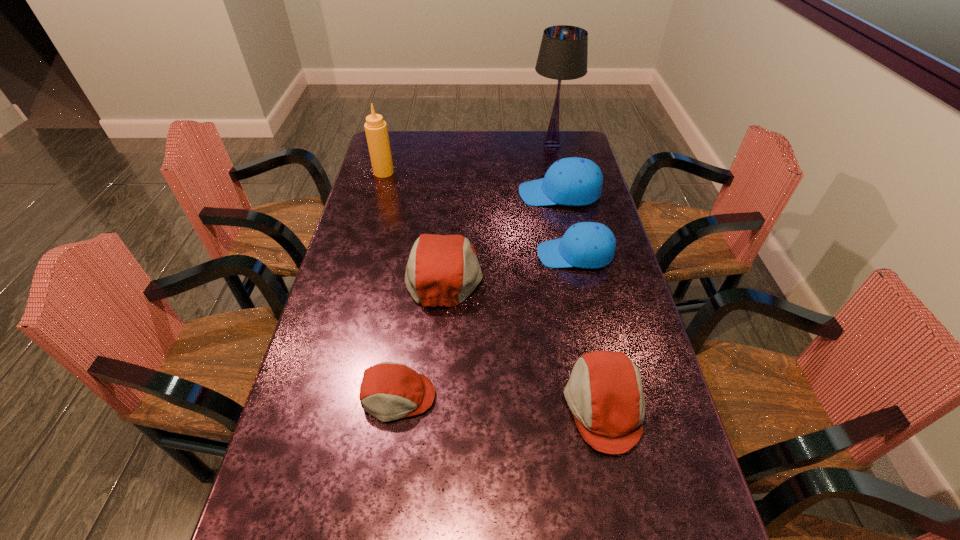
Find the location of a particular element. vacant region between the tallest object and the biggest red cap is located at coordinates (498, 209).

This screenshot has width=960, height=540. I want to click on vacant space that's between the farther blue cap and the second farthest object, so click(x=471, y=183).

Identify which object is the second nearest to the farther blue cap. Please provide its 2D coordinates. Your answer should be formatted as a tuple, i.e. [(x, y)], where the tuple contains the x and y coordinates of a point satisfying the conditions above.

[(563, 53)]

At what (x,y) coordinates should I click in order to perform the action: click on the third closest object to the leftmost object. Please return your answer as a coordinate pair (x, y). The height and width of the screenshot is (540, 960). Looking at the image, I should click on (563, 53).

Point out which cap is positioned as the third nearest to the farther blue cap. Please provide its 2D coordinates. Your answer should be formatted as a tuple, i.e. [(x, y)], where the tuple contains the x and y coordinates of a point satisfying the conditions above.

[(604, 392)]

You are a GUI agent. You are given a task and a screenshot of the screen. Output one action in this format:
    pyautogui.click(x=<x>, y=<y>)
    Task: Click on the cap that stands as the closest to the second tallest object
    
    Given the screenshot: What is the action you would take?
    pyautogui.click(x=443, y=270)

Identify the location of blue cap that is the second closest to the shortest object. The height and width of the screenshot is (540, 960). (573, 181).

Select which blue cap is the closest to the smallest red cap. Please provide its 2D coordinates. Your answer should be formatted as a tuple, i.e. [(x, y)], where the tuple contains the x and y coordinates of a point satisfying the conditions above.

[(588, 245)]

Select which red cap appears as the closest to the farthest red cap. Please provide its 2D coordinates. Your answer should be formatted as a tuple, i.e. [(x, y)], where the tuple contains the x and y coordinates of a point satisfying the conditions above.

[(389, 391)]

I want to click on red cap that is the closest to the bigger blue cap, so click(x=443, y=270).